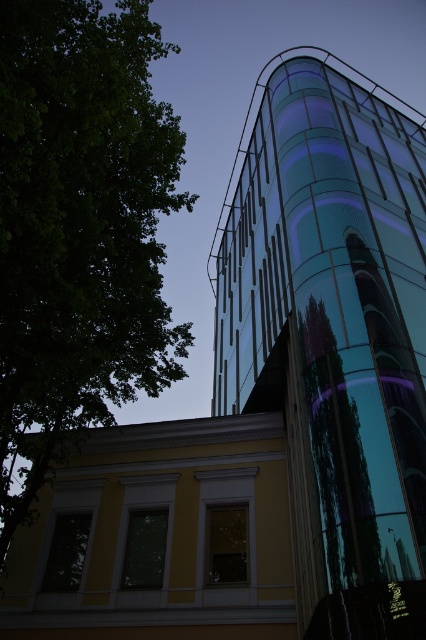
Question: Which object appears farthest from the camera in this image?

Choices:
 (A) green leafy tree at left
 (B) transparent glass tower at upper right

Answer: (B)

Question: Is transparent glass tower at upper right below green leafy tree at left?

Choices:
 (A) yes
 (B) no

Answer: (A)

Question: In this image, where is transparent glass tower at upper right located relative to green leafy tree at left?

Choices:
 (A) below
 (B) above

Answer: (A)

Question: Which point is closer to the camera taking this photo?

Choices:
 (A) (305, 176)
 (B) (104, 17)

Answer: (A)

Question: Considering the relative positions of transparent glass tower at upper right and green leafy tree at left in the image provided, where is transparent glass tower at upper right located with respect to green leafy tree at left?

Choices:
 (A) left
 (B) right

Answer: (B)